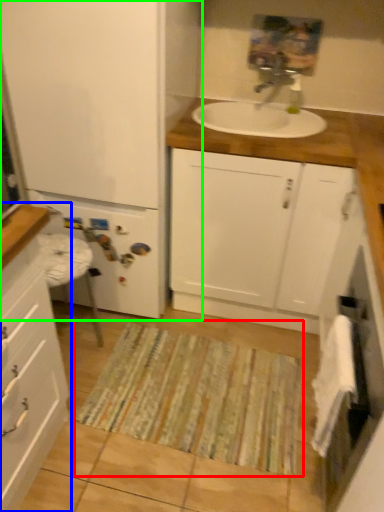
Question: Which is nearer to the doormat (highlighted by a red box)? bathroom cabinet (highlighted by a blue box) or bathroom cabinet (highlighted by a green box).

Choices:
 (A) bathroom cabinet
 (B) bathroom cabinet

Answer: (A)